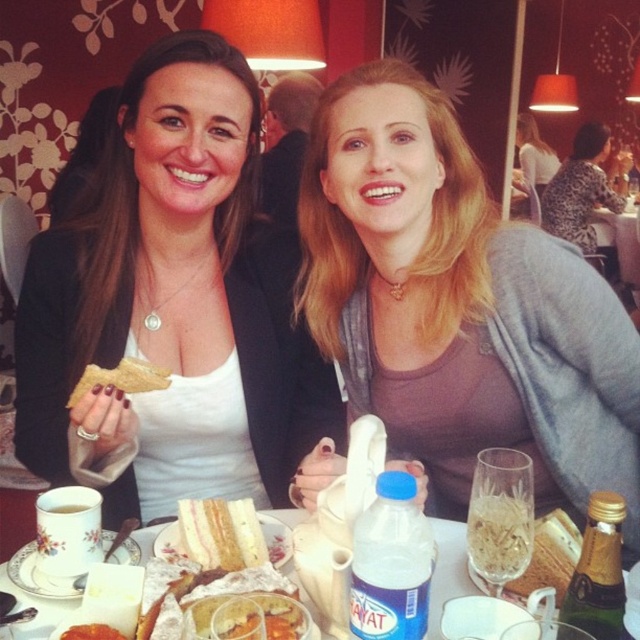
Question: Which point is closer to the camera taking this photo?

Choices:
 (A) (529, 211)
 (B) (115, 371)
 (C) (20, 580)
 (D) (595, 150)

Answer: (C)

Question: Based on their relative distances, which object is farther from the white ceramic plate at center?

Choices:
 (A) matte white shirt at center
 (B) white ceramic platter at lower left

Answer: (A)

Question: Does white ceramic plate at center come behind white ceramic platter at lower left?

Choices:
 (A) no
 (B) yes

Answer: (A)

Question: Can you confirm if matte gray sweater at center is thinner than pink sponge cake at center?

Choices:
 (A) no
 (B) yes

Answer: (A)

Question: Which of the following is the closest to the observer?

Choices:
 (A) matte gray sweater at upper right
 (B) leopard print dress at upper right
 (C) white ceramic platter at lower left
 (D) pink sponge cake at center

Answer: (C)

Question: Can you confirm if leopard print dress at upper right is wider than white ceramic platter at lower left?

Choices:
 (A) no
 (B) yes

Answer: (B)